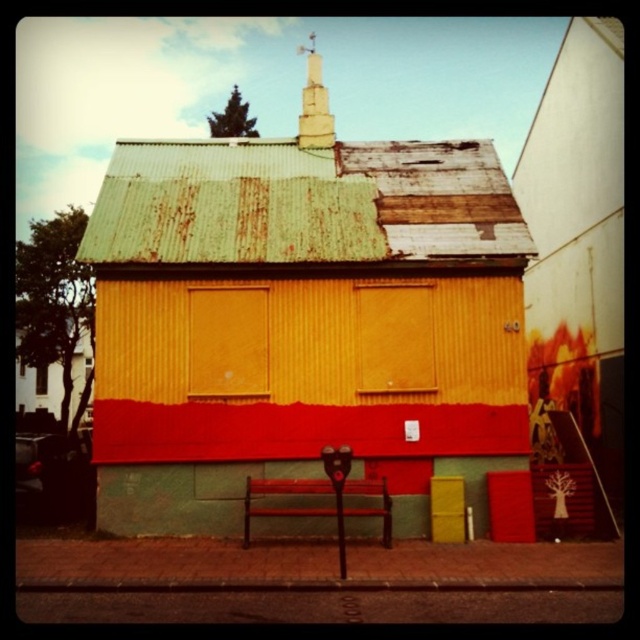
Question: Is rusty corrugated metal church at center above smooth white spire at upper center?

Choices:
 (A) yes
 (B) no

Answer: (B)

Question: Does rusty corrugated metal church at center have a larger size compared to smooth white spire at upper center?

Choices:
 (A) no
 (B) yes

Answer: (A)

Question: Can you confirm if rusty corrugated metal church at center is smaller than smooth white spire at upper center?

Choices:
 (A) no
 (B) yes

Answer: (B)